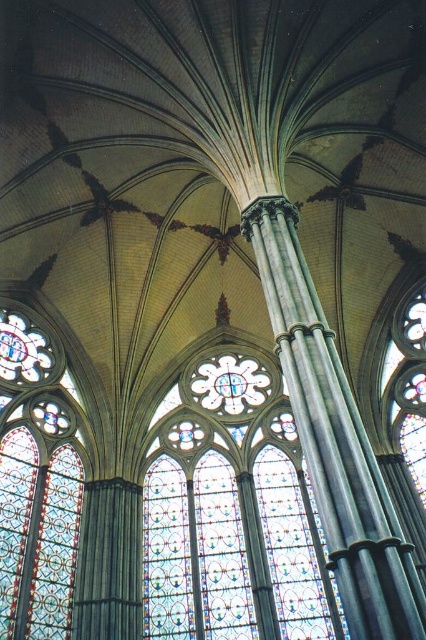
Question: Considering the relative positions of stained glass at center and stained glass window at left in the image provided, where is stained glass at center located with respect to stained glass window at left?

Choices:
 (A) right
 (B) left

Answer: (A)

Question: Which point is closer to the camera?

Choices:
 (A) polished stone column at center
 (B) stained glass window at left

Answer: (A)

Question: Which of these objects is positioned farthest from the stained glass window at left?

Choices:
 (A) stained glass at center
 (B) polished stone column at center

Answer: (B)

Question: Is stained glass at center bigger than stained glass window at left?

Choices:
 (A) no
 (B) yes

Answer: (B)

Question: Which object is the farthest from the stained glass at center?

Choices:
 (A) polished stone column at center
 (B) stained glass window at left

Answer: (A)

Question: Is stained glass at center bigger than polished stone column at center?

Choices:
 (A) yes
 (B) no

Answer: (A)